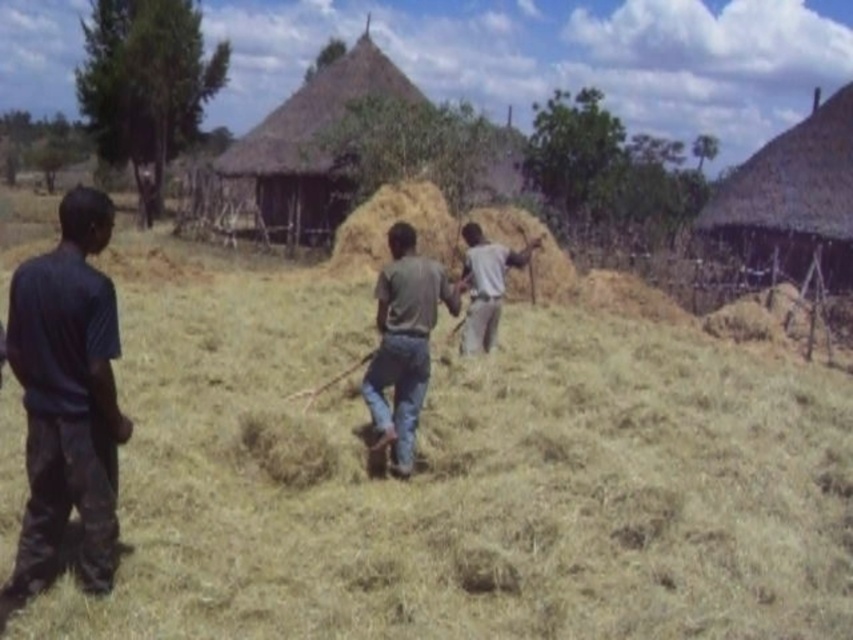
Between point (114, 492) and point (445, 304), which one is positioned in front?

Point (114, 492) is more forward.

Is point (28, 564) less distant than point (381, 349)?

Yes, point (28, 564) is in front of point (381, 349).

Is point (30, 401) behind point (383, 276)?

No, (30, 401) is closer to viewer.

You are a GUI agent. You are given a task and a screenshot of the screen. Output one action in this format:
    pyautogui.click(x=<x>, y=<y>)
    Task: Click on the dark blue shirt at left
    The width and height of the screenshot is (853, 640).
    Given the screenshot: What is the action you would take?
    pyautogui.click(x=67, y=396)

Between dark gray jeans at center and gray matte shirt at center, which one is positioned higher?

Positioned higher is gray matte shirt at center.

Can you confirm if dark gray jeans at center is thinner than gray matte shirt at center?

Yes.

Locate an element on the screen. This screenshot has width=853, height=640. dark gray jeans at center is located at coordinates (403, 340).

Between dry straw at center and gray matte shirt at center, which one has more height?

Standing taller between the two is dry straw at center.

Is point (775, 540) positioned before point (527, 257)?

Yes, point (775, 540) is closer to viewer.

Identify the location of dry straw at center. (457, 477).